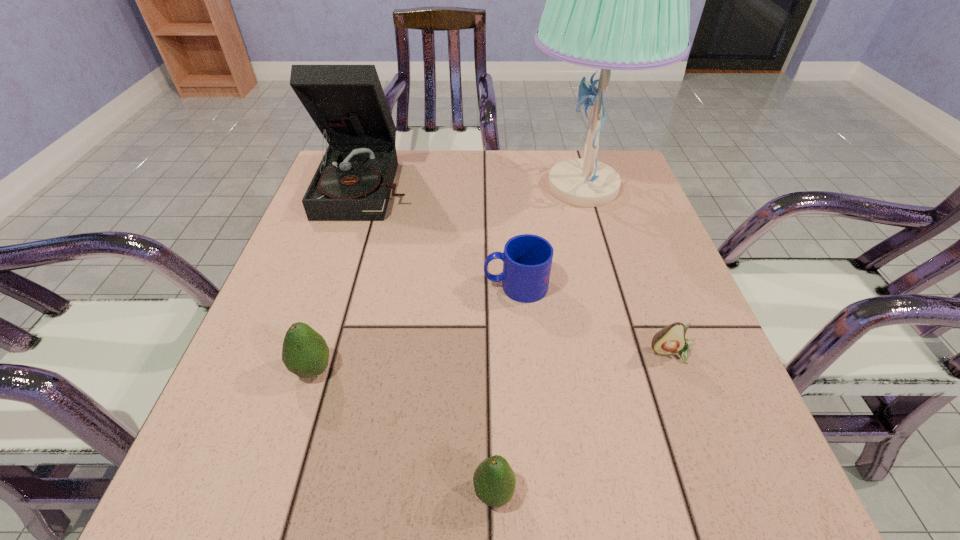
Point out which avocado is positioned as the nearest to the fifth shortest object. Please provide its 2D coordinates. Your answer should be formatted as a tuple, i.e. [(x, y)], where the tuple contains the x and y coordinates of a point satisfying the conditions above.

[(305, 353)]

Identify which avocado is located as the third nearest to the third farthest object. Please provide its 2D coordinates. Your answer should be formatted as a tuple, i.e. [(x, y)], where the tuple contains the x and y coordinates of a point satisfying the conditions above.

[(494, 481)]

This screenshot has height=540, width=960. I want to click on free space that satisfies the following two spatial constraints: 1. on the side with the handle of the mug; 2. on the front side of the tallest avocado, so click(x=522, y=369).

The height and width of the screenshot is (540, 960). Identify the location of free space that satisfies the following two spatial constraints: 1. on the front-facing side of the phonograph_record; 2. on the right side of the second avocado from right to left. (270, 492).